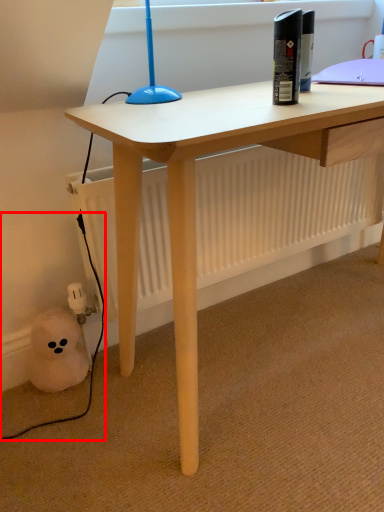
Question: Observing the image, what is the correct spatial positioning of cable (annotated by the red box) in reference to bottle?

Choices:
 (A) right
 (B) left

Answer: (B)